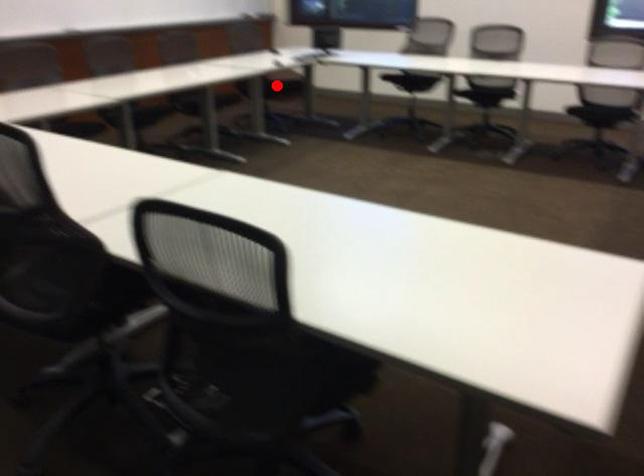
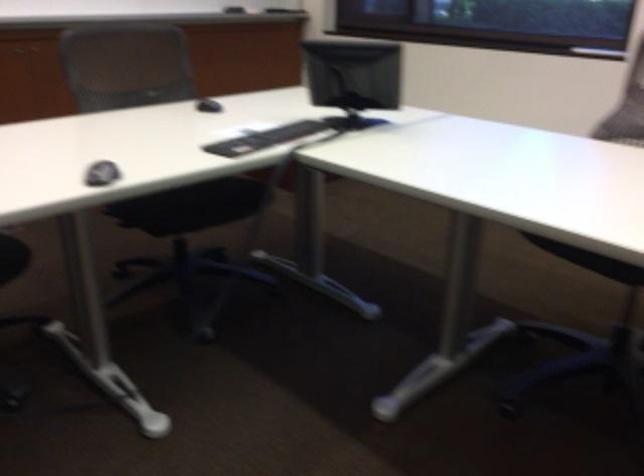
Question: I am providing you with two images of the same scene from different viewpoints. A red point is marked on the first image. At the location where the point appears in image 1, is it still visible in image 2?

Choices:
 (A) Yes
 (B) No

Answer: (B)